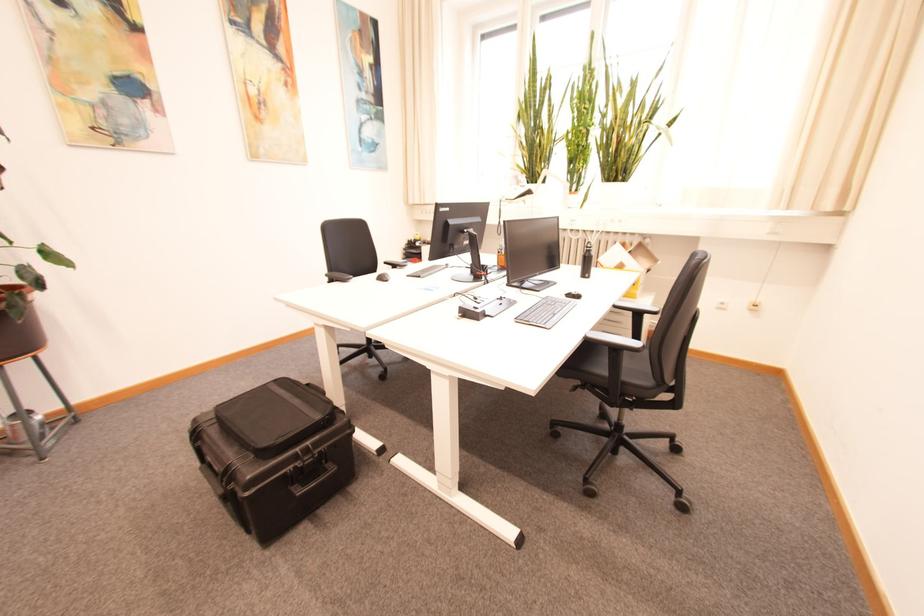
I want to click on chair sitting surface, so click(x=631, y=374).